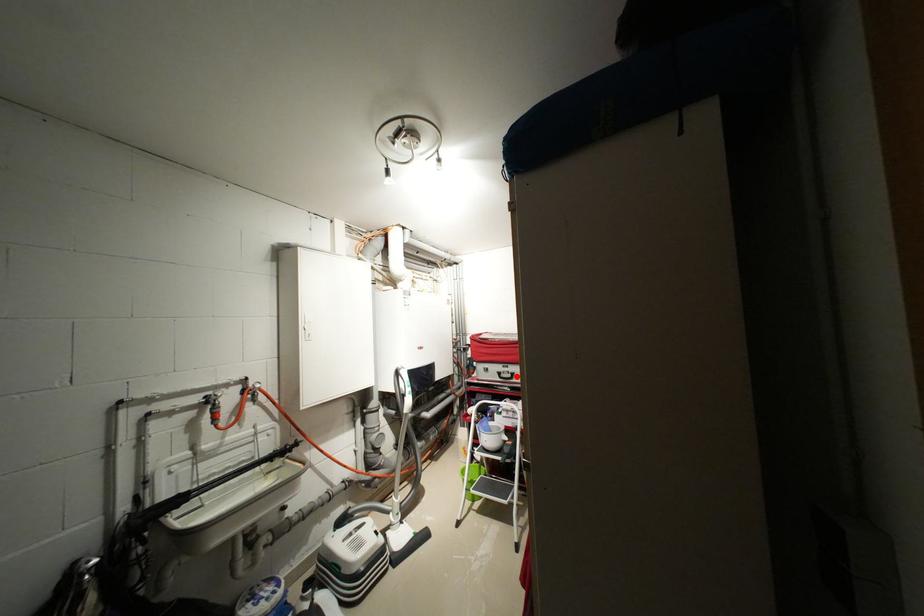
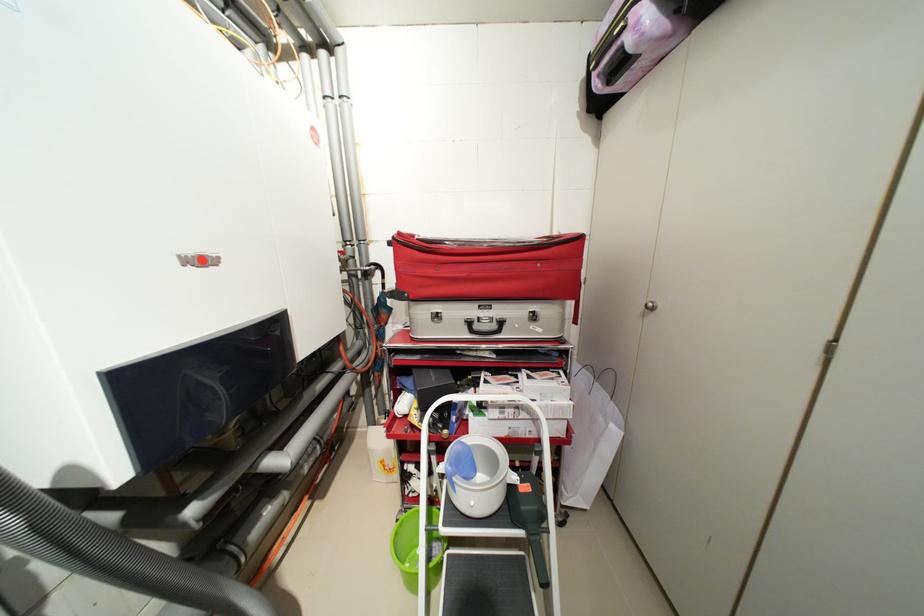
Where in the second image is the point corresponding to the highlighted location from the first image?

(502, 326)